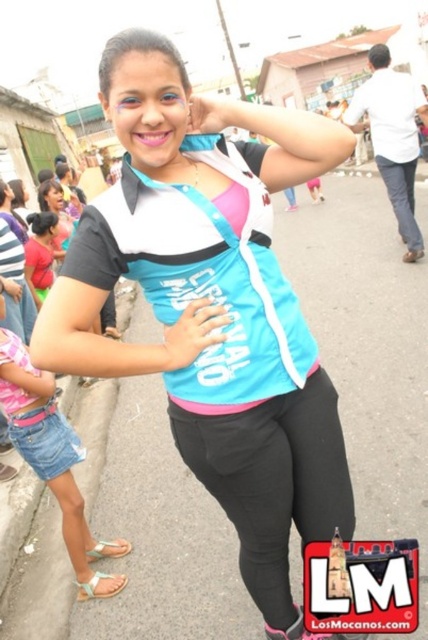
You are a photographer trying to capture a candid shot of the denim shorts at lower left and the matte pink shirt at left. Based on their positions, which object should you focus on first to ensure both are in frame?

The denim shorts at lower left is located below the matte pink shirt at left, so you should focus on the matte pink shirt at left first to ensure both are in frame.

You are a photographer trying to capture both the denim shorts at lower left and the matte pink shirt at left in the same frame. Based on their positions, which object should you focus on first to ensure both are in the frame?

The denim shorts at lower left is much taller than the matte pink shirt at left, so focusing on the denim shorts at lower left first will help ensure both are in the frame.

You are a photographer trying to capture a closeup of the denim shorts at lower left and the matte black shirt at left. Since you want both items to appear similarly sized in the photo, which object should you move closer to the camera and which should you move farther away?

The denim shorts at lower left is smaller than the matte black shirt at left. To make them appear similarly sized in the photo, move the denim shorts at lower left closer to the camera and move the matte black shirt at left farther away.